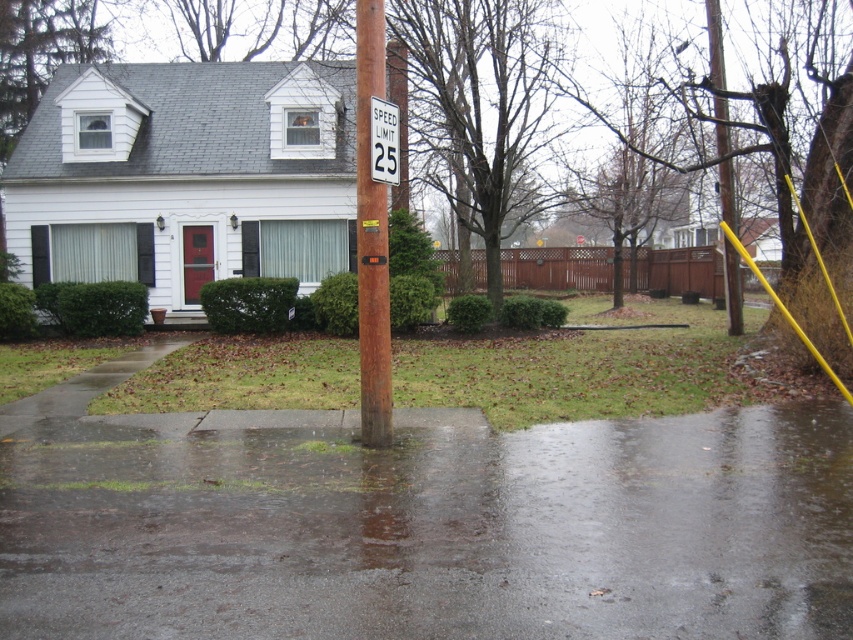
Question: Where is bare wood tree at center located in relation to yellow painted wood at upper right in the image?

Choices:
 (A) below
 (B) above

Answer: (B)

Question: Which of the following is the farthest from the observer?

Choices:
 (A) bare wood tree at center
 (B) white plastic speed limit sign at center

Answer: (A)

Question: Which point appears farthest from the camera in this image?

Choices:
 (A) (711, 17)
 (B) (430, 172)
 (C) (378, 317)
 (D) (64, 500)

Answer: (B)

Question: Which is nearer to the wet asphalt at center?

Choices:
 (A) white plastic speed limit sign at center
 (B) rusty metal pole at center
 (C) bare wood tree at center
 (D) yellow painted wood at upper right

Answer: (B)

Question: Considering the relative positions of wet asphalt at center and bare wood tree at center in the image provided, where is wet asphalt at center located with respect to bare wood tree at center?

Choices:
 (A) left
 (B) right

Answer: (A)

Question: Is bare wood tree at center bigger than rusty metal pole at center?

Choices:
 (A) yes
 (B) no

Answer: (A)